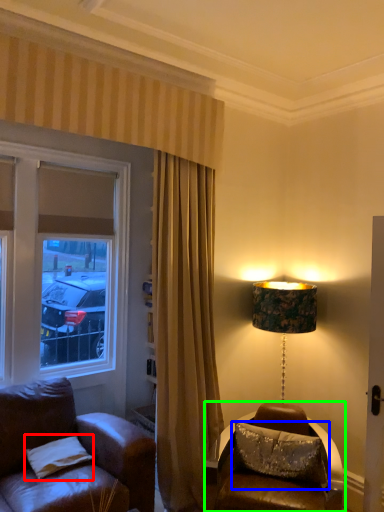
Question: Which object is positioned farthest from pillow (highlighted by a red box)? Select from pillow (highlighted by a blue box) and table (highlighted by a green box).

Choices:
 (A) pillow
 (B) table

Answer: (A)